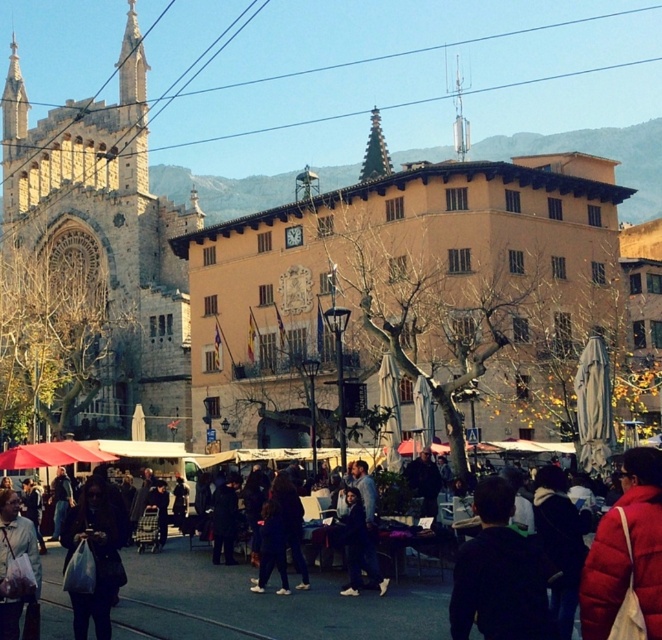
You are a photographer trying to capture a photo of the dark brown hair at center and the matte black jacket at lower left. Which object should you focus on first if you want to include both in your frame without moving the camera?

The dark brown hair at center is positioned on the right side of the matte black jacket at lower left, so you should focus on the matte black jacket at lower left first to ensure both are in frame without moving the camera.

You are a photographer standing in the market square. You want to take a photo of both the dark brown hair at center and the matte red jacket at center. Which object should you focus on first if you want to ensure both are in sharp focus?

You should focus on the dark brown hair at center first because it is taller than the matte red jacket at center, so focusing on the taller object will help ensure both are in focus.